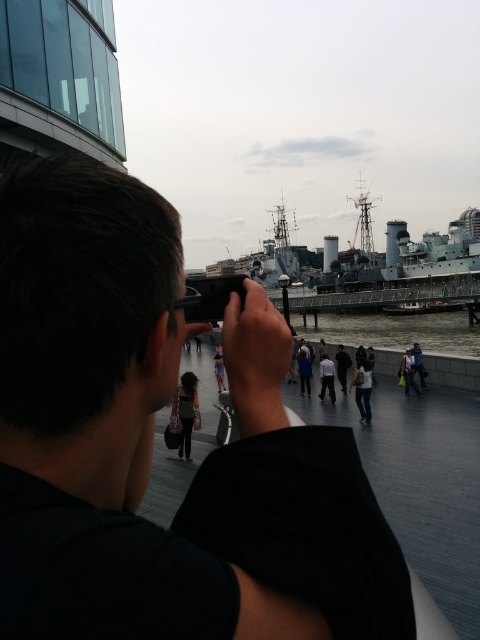
Question: Is black matte camera at center smaller than clear water at center?

Choices:
 (A) no
 (B) yes

Answer: (A)

Question: Which point is farther from the camera taking this photo?

Choices:
 (A) click(x=408, y=378)
 (B) click(x=432, y=272)
 (C) click(x=369, y=388)
 (D) click(x=156, y=260)

Answer: (B)

Question: In this image, where is light gray cotton shirt at center located relative to white shirt at center?

Choices:
 (A) above
 (B) below

Answer: (B)

Question: Is light gray cotton shirt at center to the left of white shirt at center from the viewer's perspective?

Choices:
 (A) yes
 (B) no

Answer: (B)

Question: Which point appears closest to the camera in this image?

Choices:
 (A) (408, 368)
 (B) (326, 372)
 (C) (326, 465)
 (D) (417, 330)

Answer: (C)

Question: Among these objects, which one is farthest from the camera?

Choices:
 (A) clear water at center
 (B) silhouette fabric dress at center
 (C) light gray cotton shirt at center

Answer: (A)